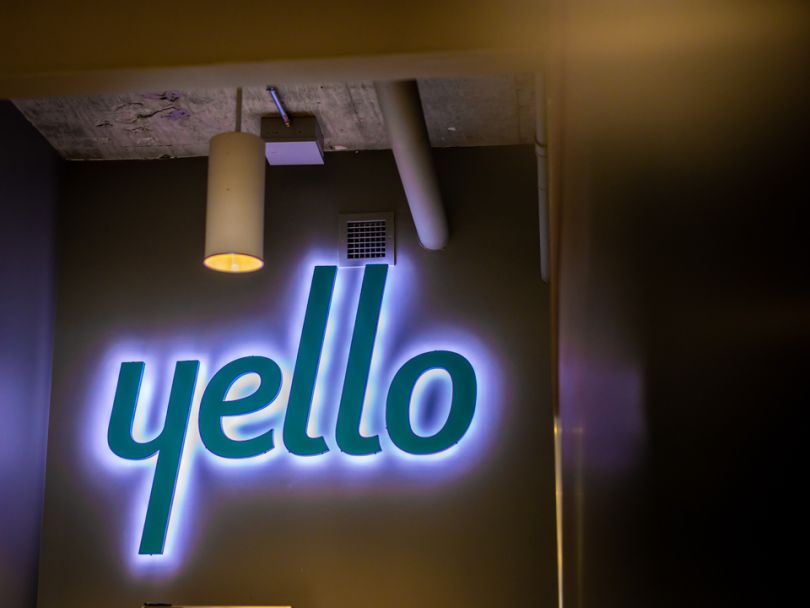
The width and height of the screenshot is (810, 608). Find the location of `wooden ceiling`. wooden ceiling is located at coordinates (455, 108), (142, 126).